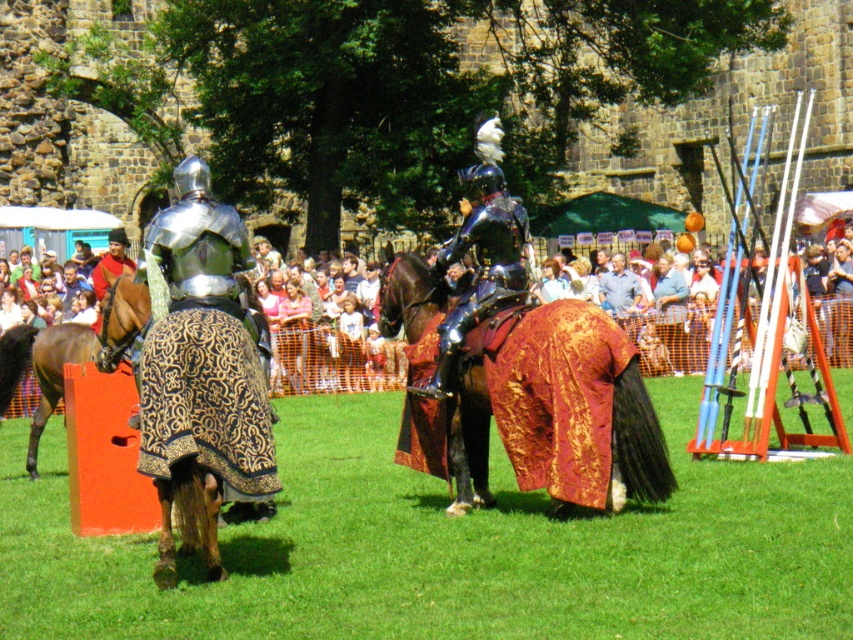
Question: Is green grass at lower center to the right of shiny black armor at center from the viewer's perspective?

Choices:
 (A) no
 (B) yes

Answer: (A)

Question: Is shiny gold fabric horse at center bigger than brown glossy horse at left?

Choices:
 (A) no
 (B) yes

Answer: (A)

Question: Considering the real-world distances, which object is farthest from the shiny black armor at center?

Choices:
 (A) golden patterned blanket at rear left
 (B) green grass at lower center
 (C) brown glossy horse at left
 (D) shiny gold fabric horse at center

Answer: (C)

Question: Which point is closer to the camera?

Choices:
 (A) click(421, 352)
 (B) click(9, 381)
 (C) click(187, 483)
 (D) click(424, 586)

Answer: (D)

Question: Which is farther from the green grass at lower center?

Choices:
 (A) shiny gold fabric horse at center
 (B) shiny black armor at center

Answer: (B)

Question: Does golden patterned blanket at rear left lie in front of shiny black armor at center?

Choices:
 (A) no
 (B) yes

Answer: (B)